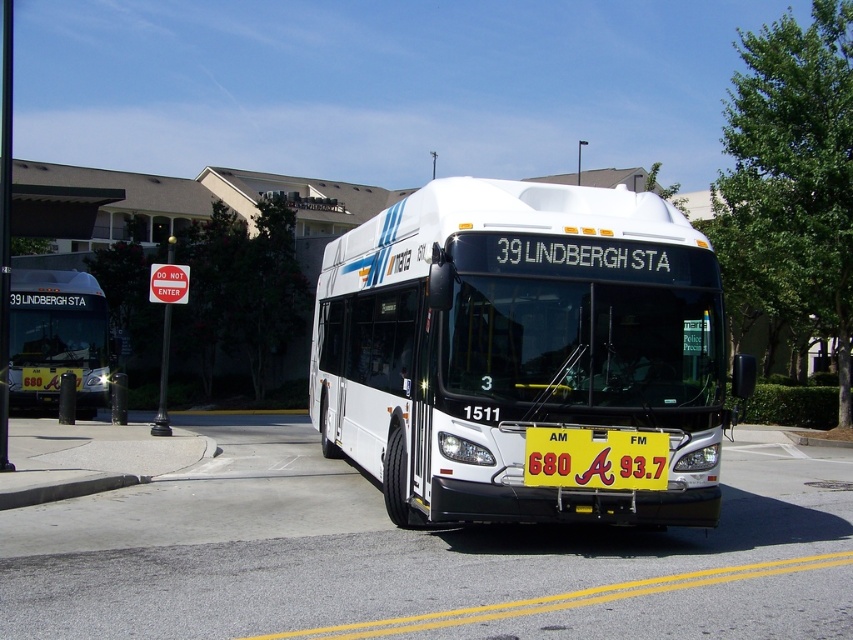
Question: Based on their relative distances, which object is nearer to the white matte bus at center?

Choices:
 (A) white glossy bus at center
 (B) yellow plastic sign at center

Answer: (B)

Question: Which of the following is the closest to the observer?

Choices:
 (A) yellow plastic sign at center
 (B) white glossy bus at center
 (C) white matte bus at center

Answer: (A)

Question: Is white matte bus at center to the right of yellow plastic sign at center from the viewer's perspective?

Choices:
 (A) no
 (B) yes

Answer: (A)

Question: Is white glossy bus at center bigger than yellow plastic sign at center?

Choices:
 (A) no
 (B) yes

Answer: (A)

Question: Can you confirm if white matte bus at center is positioned above yellow plastic sign at center?

Choices:
 (A) no
 (B) yes

Answer: (B)

Question: Which object is positioned farthest from the white glossy bus at center?

Choices:
 (A) white matte bus at center
 (B) yellow plastic sign at center

Answer: (A)